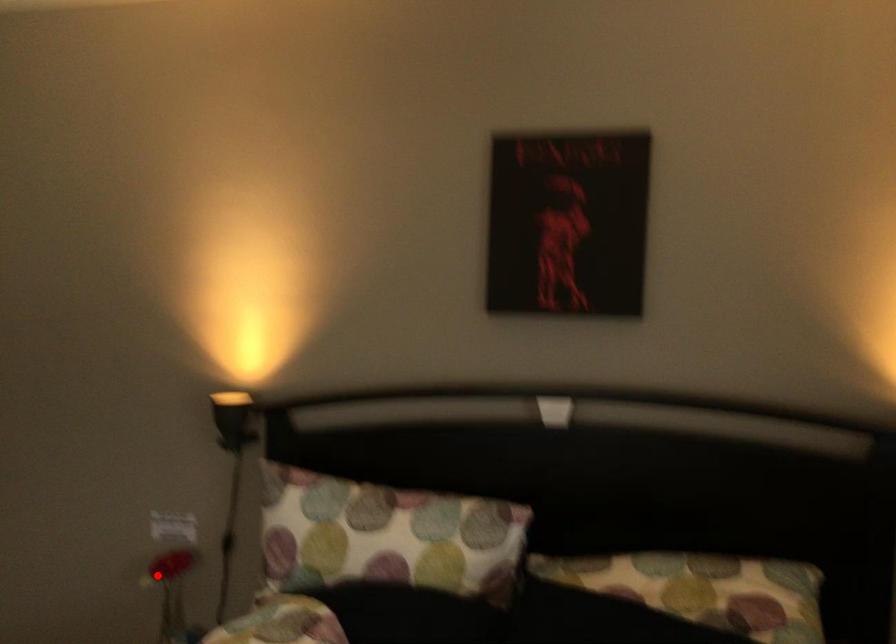
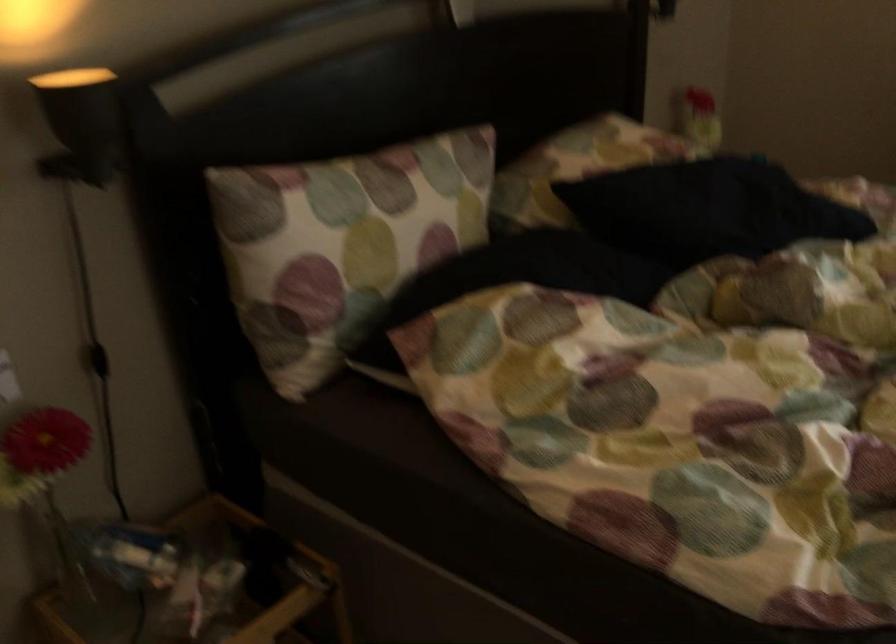
Question: I am providing you with two images of the same scene from different viewpoints. Given a red point in image1, look at the same physical point in image2. Is it:

Choices:
 (A) Closer to the viewpoint
 (B) Farther from the viewpoint

Answer: (A)